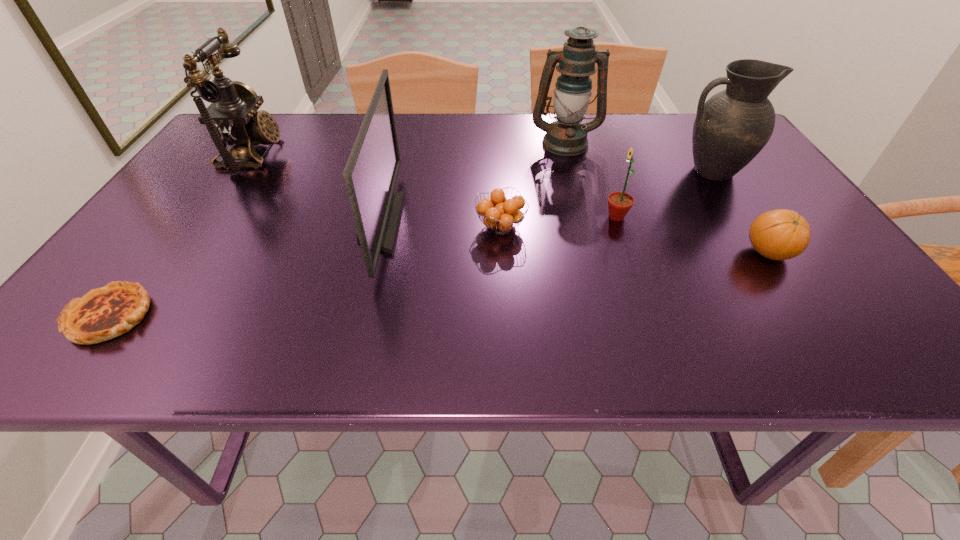
Locate an element on the screen. free region located 0.100m on the right of the left orange fruit is located at coordinates (572, 227).

Locate an element on the screen. free space located 0.070m on the right of the shortest object is located at coordinates (187, 316).

You are a GUI agent. You are given a task and a screenshot of the screen. Output one action in this format:
    pyautogui.click(x=<x>, y=<y>)
    Task: Click on the oil lamp present at the far edge
    
    Given the screenshot: What is the action you would take?
    pyautogui.click(x=576, y=62)

Identify the location of telephone that is at the far edge. (232, 118).

The height and width of the screenshot is (540, 960). Identify the location of pitcher that is at the far edge. (732, 127).

I want to click on object at the near edge, so click(104, 313).

Identify the location of telephone that is at the left edge. Image resolution: width=960 pixels, height=540 pixels. (232, 118).

Find the location of `quiche that is positioned at the left edge`. quiche that is positioned at the left edge is located at coordinates (104, 313).

The height and width of the screenshot is (540, 960). I want to click on pitcher that is at the right edge, so click(x=732, y=127).

The height and width of the screenshot is (540, 960). I want to click on orange that is at the right edge, so click(781, 234).